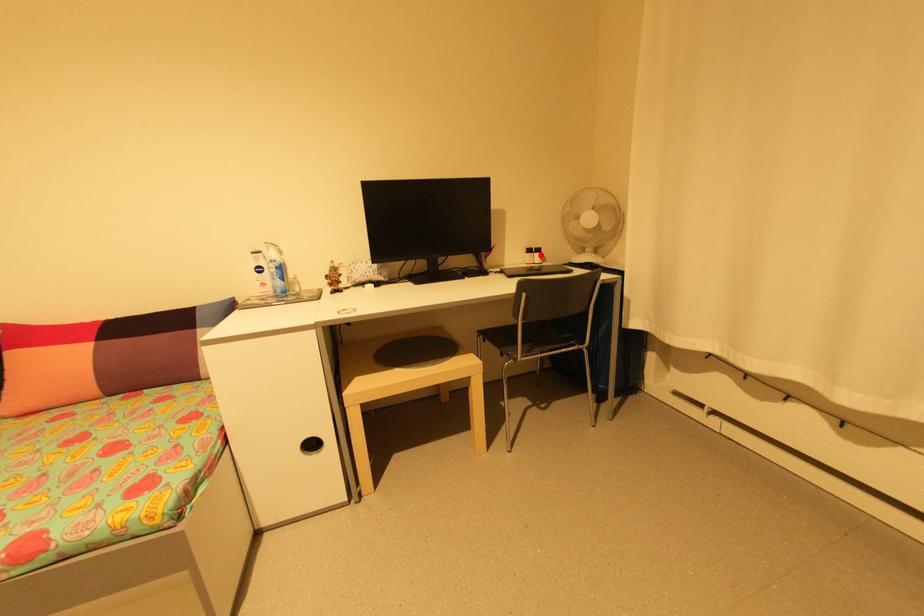
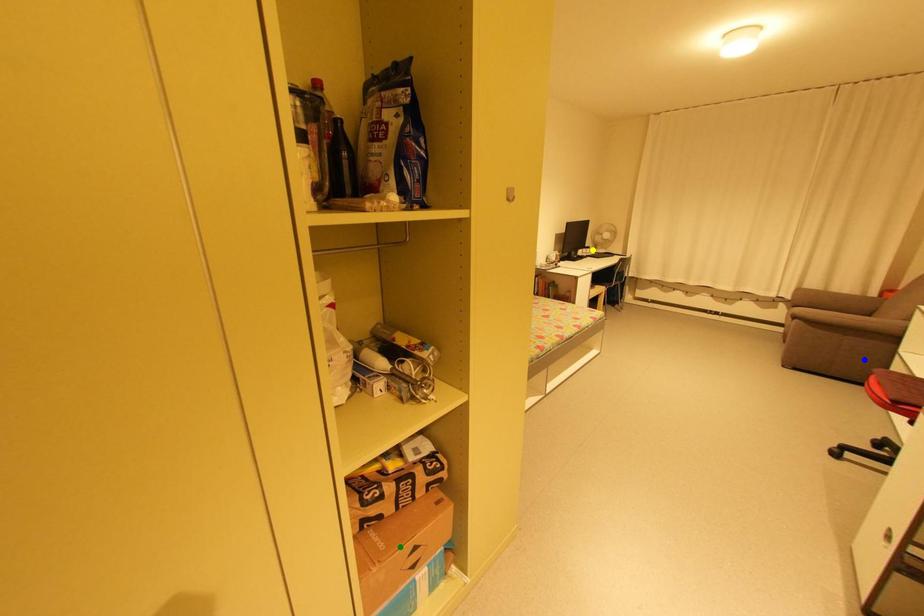
Question: I am providing you with two images of the same scene from different viewpoints. A red point is marked on the first image. You are given multiple points on the second image. Which point in image 2 is actually the same real-world point as the red point in image 1?

Choices:
 (A) blue point
 (B) yellow point
 (C) green point

Answer: (B)